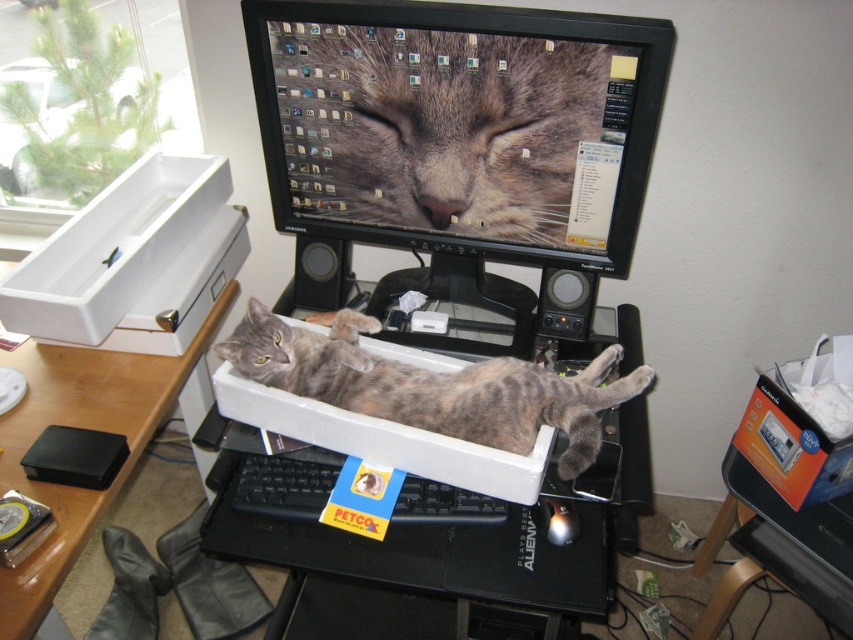
Question: Which point is closer to the camera?

Choices:
 (A) (759, 433)
 (B) (450, 500)
 (C) (45, 596)
 (D) (550, 250)

Answer: (C)

Question: Can you confirm if white plastic box at left is smaller than gray fur cat at center?

Choices:
 (A) no
 (B) yes

Answer: (A)

Question: Can you confirm if white plastic box at left is smaller than gray fur cat at center?

Choices:
 (A) yes
 (B) no

Answer: (B)

Question: Among these points, which one is farthest from the camera?

Choices:
 (A) (329, 465)
 (B) (535, 380)

Answer: (A)

Question: Estimate the real-world distances between objects in this image. Which object is closer to the black glossy monitor at upper center?

Choices:
 (A) orange cardboard box at lower right
 (B) black plastic keyboard at center
 (C) matte black monitor at center

Answer: (C)

Question: From the image, what is the correct spatial relationship of black glossy monitor at upper center in relation to wooden table at lower left?

Choices:
 (A) below
 (B) above

Answer: (B)